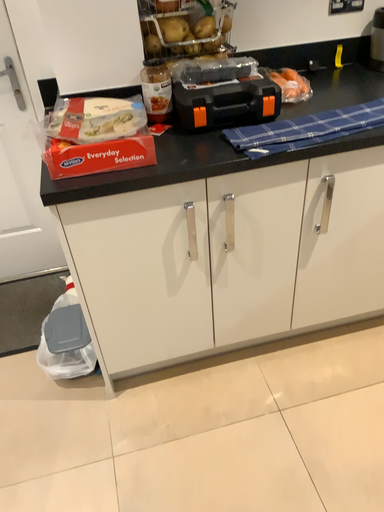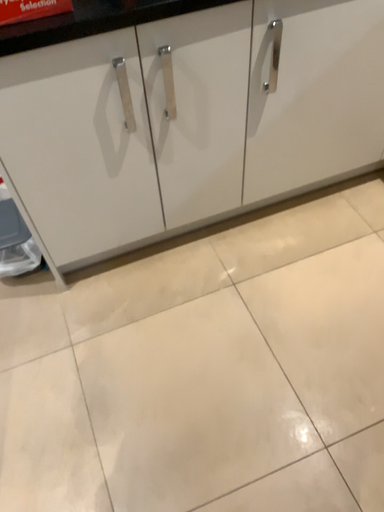
Question: Which way did the camera rotate in the video?

Choices:
 (A) rotated right
 (B) rotated left

Answer: (A)